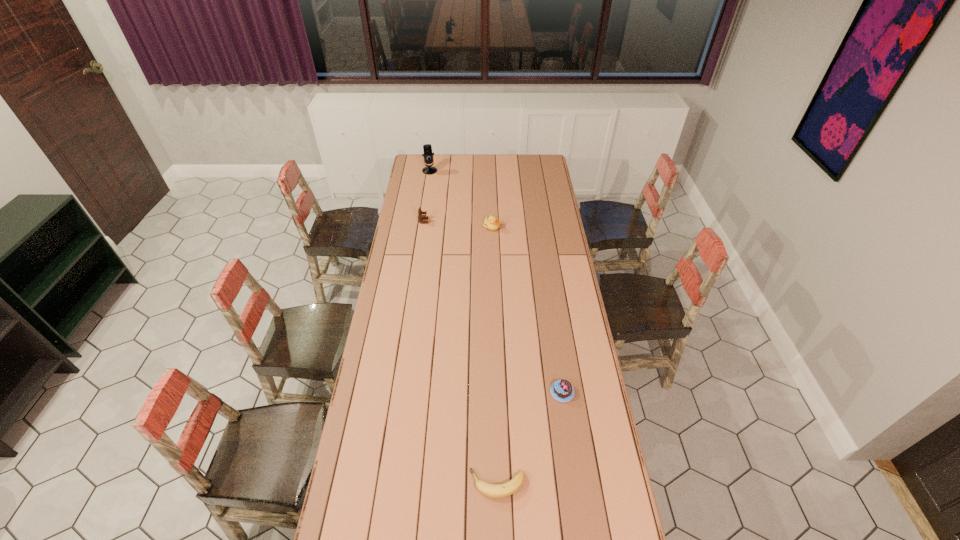
The width and height of the screenshot is (960, 540). Identify the location of vacant position in the image that satisfies the following two spatial constraints: 1. on the front-facing side of the rightmost object; 2. on the right side of the duckling. (496, 392).

You are a GUI agent. You are given a task and a screenshot of the screen. Output one action in this format:
    pyautogui.click(x=<x>, y=<y>)
    Task: Click on the vacant space that satisfies the following two spatial constraints: 1. on the front-facing side of the duckling; 2. at the stem of the shortest object
    Image resolution: width=960 pixels, height=540 pixels.
    Given the screenshot: What is the action you would take?
    pyautogui.click(x=499, y=484)

Locate an element on the screen. vacant region that satisfies the following two spatial constraints: 1. on the stand of the rightmost object; 2. on the right side of the farthest object is located at coordinates (396, 392).

I want to click on vacant space that satisfies the following two spatial constraints: 1. on the front-facing side of the rightmost object; 2. on the right side of the duckling, so click(x=496, y=392).